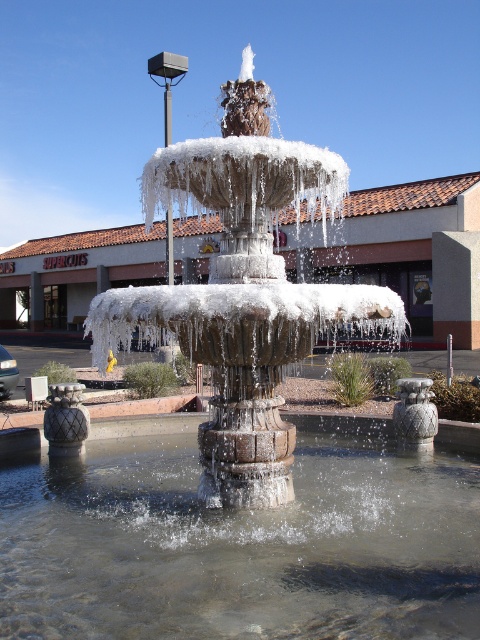
You are standing at the edge of the icy stone fountain at center and want to reach the clear water at center. Which direction should you move towards?

You should move to the right to reach the clear water at center, as it is located to the right of the icy stone fountain at center.

You are standing at the point marked as point (240, 541) in the image. What is the surface you are currently standing on?

You are standing on clear water at center because the point (240, 541) is on clear water at center.

A person wants to walk from the icy stone fountain at center to the nearby bench. The bench is located 4.17 meters away. If the person walks at a speed of 1.5 meters per second, how long will it take them to reach the bench?

The distance between the icy stone fountain at center and the bench is 4.17 meters. At a walking speed of 1.5 meters per second, it would take approximately 2.78 seconds to reach the bench.